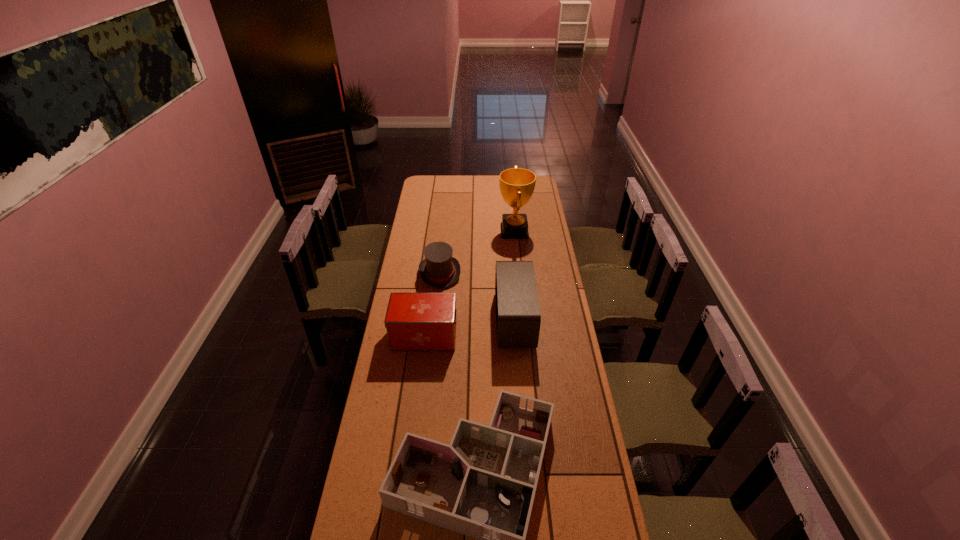
Locate an element on the screen. Image resolution: width=960 pixels, height=540 pixels. vacant area at the right edge is located at coordinates (549, 232).

Locate an element on the screen. The image size is (960, 540). vacant area at the far left corner of the desktop is located at coordinates (428, 185).

I want to click on free point between the farthest object and the second shortest object, so click(x=477, y=252).

Locate an element on the screen. vacant point located between the third shortest object and the radio receiver is located at coordinates (469, 328).

Where is `free space that is in between the tallest object and the dress hat`? free space that is in between the tallest object and the dress hat is located at coordinates (477, 252).

The width and height of the screenshot is (960, 540). I want to click on unoccupied position between the radio receiver and the dress hat, so click(477, 297).

Identify the location of object that is the second closest to the dress hat. The height and width of the screenshot is (540, 960). (414, 321).

Identify which object is located as the fourth nearest to the radio receiver. Please provide its 2D coordinates. Your answer should be formatted as a tuple, i.e. [(x, y)], where the tuple contains the x and y coordinates of a point satisfying the conditions above.

[(517, 185)]

The height and width of the screenshot is (540, 960). In order to click on free space that satisfies the following two spatial constraints: 1. on the front side of the second shortest object; 2. on the handle side of the third tallest object in this screenshot , I will do `click(433, 336)`.